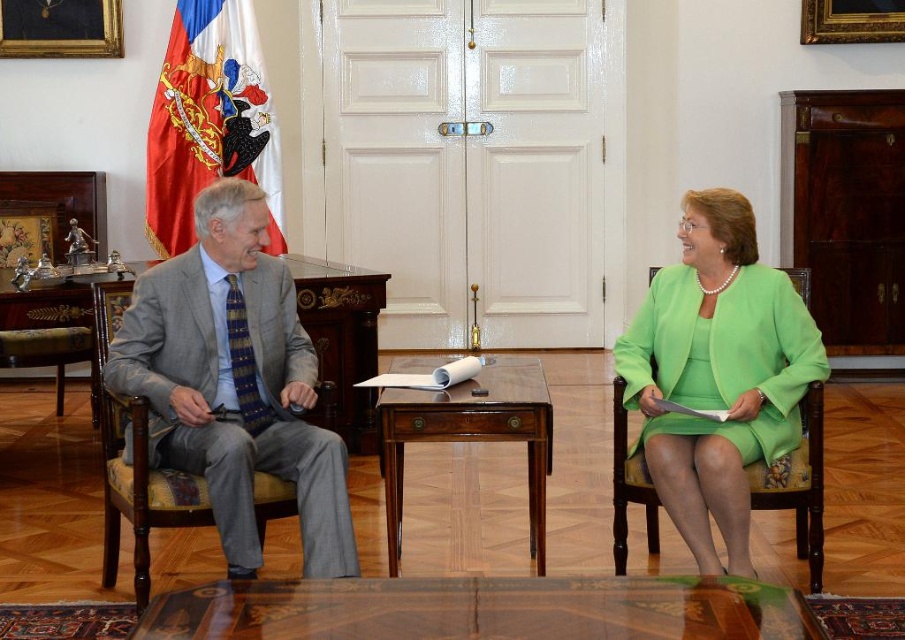
Question: From the image, what is the correct spatial relationship of green satin dress at right in relation to mahogany wood table at center?

Choices:
 (A) above
 (B) below

Answer: (A)

Question: Can you confirm if mahogany wood table at center is positioned above wooden polished table at center?

Choices:
 (A) no
 (B) yes

Answer: (A)

Question: Among these objects, which one is farthest from the camera?

Choices:
 (A) wooden polished table at center
 (B) wooden at center
 (C) red fabric flag at upper left

Answer: (C)

Question: Among these points, which one is nearest to the camera?

Choices:
 (A) pyautogui.click(x=729, y=268)
 (B) pyautogui.click(x=799, y=612)

Answer: (B)

Question: Among these points, which one is nearest to the camera?

Choices:
 (A) (313, 376)
 (B) (235, 112)
 (C) (169, 342)

Answer: (C)

Question: Does red fabric flag at upper left have a lesser width compared to mahogany wood table at center?

Choices:
 (A) no
 (B) yes

Answer: (A)